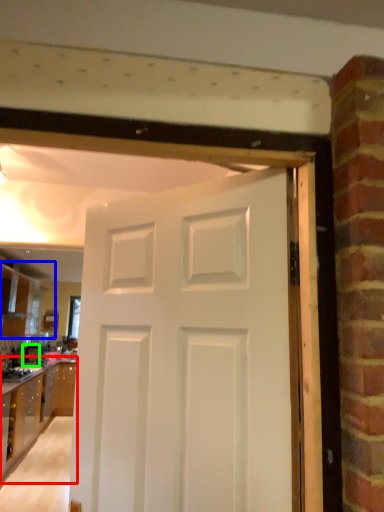
Question: Which is farther away from cabinetry (highlighted by a red box)? cabinetry (highlighted by a blue box) or appliance (highlighted by a green box)?

Choices:
 (A) cabinetry
 (B) appliance

Answer: (A)